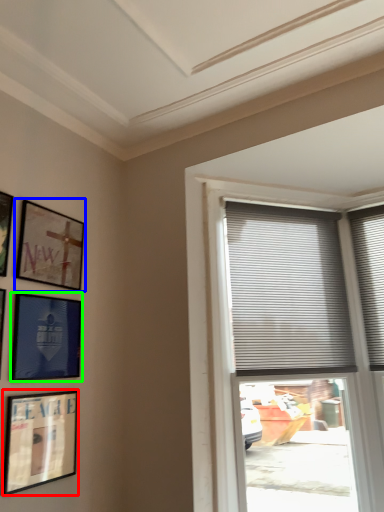
Question: Estimate the real-world distances between objects in this image. Which object is farther from picture frame (highlighted by a red box), picture frame (highlighted by a blue box) or picture frame (highlighted by a green box)?

Choices:
 (A) picture frame
 (B) picture frame

Answer: (A)